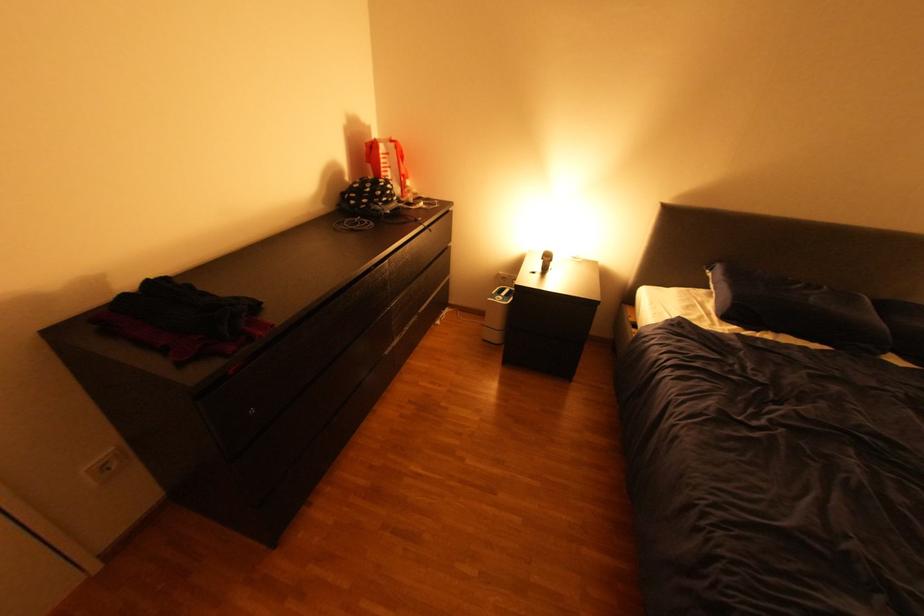
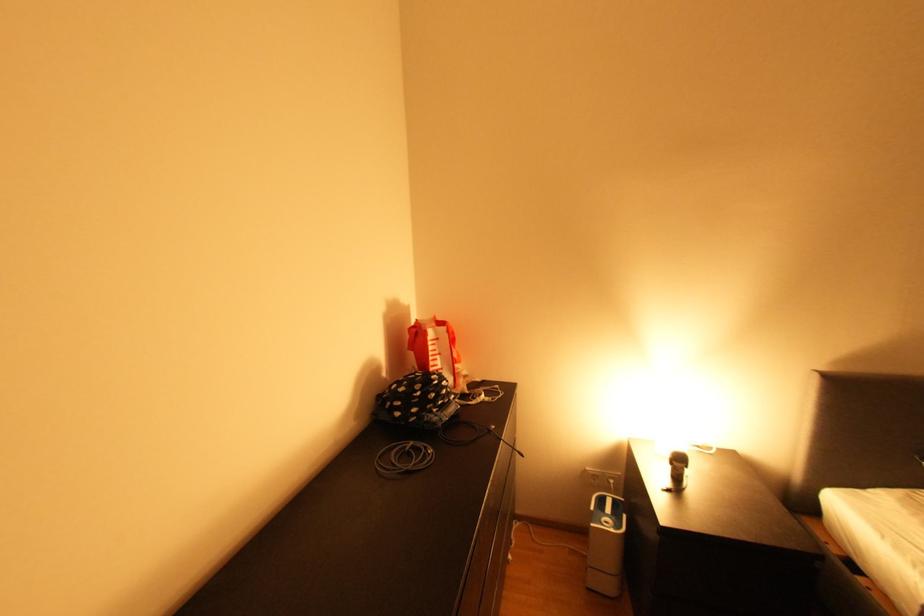
Where in the second image is the point corresponding to point (421, 221) from the first image?

(494, 434)